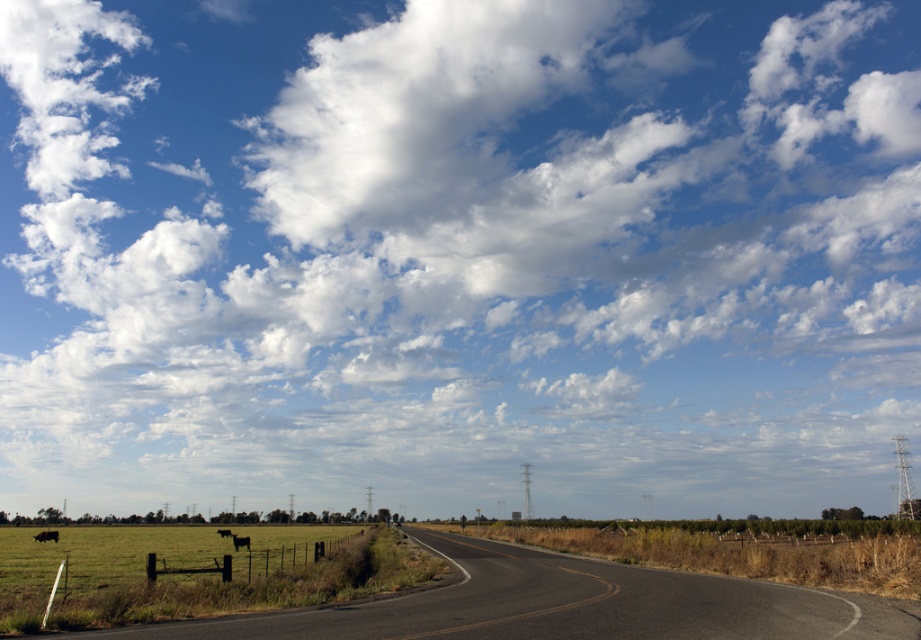
Question: Which object appears farthest from the camera in this image?

Choices:
 (A) black matte cow at lower left
 (B) black asphalt highway at lower center
 (C) black glossy cow at left
 (D) black furry cow at left

Answer: (A)

Question: Is black asphalt highway at lower center positioned in front of black furry cow at left?

Choices:
 (A) yes
 (B) no

Answer: (A)

Question: Is the position of black glossy cow at left less distant than that of black matte cow at lower left?

Choices:
 (A) no
 (B) yes

Answer: (B)

Question: Which point is closer to the camera?

Choices:
 (A) black furry cow at left
 (B) black matte cow at lower left
 (C) black glossy cow at left
 (D) black asphalt highway at lower center

Answer: (D)

Question: Which object appears farthest from the camera in this image?

Choices:
 (A) black glossy cow at left
 (B) black asphalt highway at lower center
 (C) black furry cow at left

Answer: (A)

Question: Is black glossy cow at left in front of black matte cow at lower left?

Choices:
 (A) yes
 (B) no

Answer: (A)